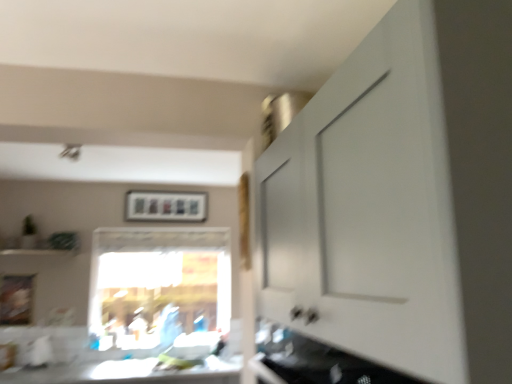
Question: Is point (287, 370) positioned closer to the camera than point (203, 200)?

Choices:
 (A) closer
 (B) farther

Answer: (A)

Question: Would you say white glossy cabinet at lower right, positioned as the 2th cabinetry in top-to-bottom order, is inside or outside matte plastic picture frame at upper center, the 2th picture frame positioned from the left?

Choices:
 (A) outside
 (B) inside

Answer: (A)

Question: Based on their relative distances, which object is farther from the matte plastic picture frame at upper center, which is the first picture frame from top to bottom?

Choices:
 (A) white glossy countertop at lower center
 (B) transparent glass window at center
 (C) white matte cabinet at upper right, which appears as the first cabinetry when viewed from the top
 (D) white glossy cabinet at lower right, which is the first cabinetry from bottom to top
 (E) wooden picture frame at lower left, arranged as the second picture frame when viewed from the back

Answer: (C)

Question: Considering the real-world distances, which object is closest to the wooden picture frame at lower left, arranged as the second picture frame when viewed from the back?

Choices:
 (A) transparent glass window at center
 (B) matte plastic picture frame at upper center, placed as the second picture frame when sorted from front to back
 (C) white glossy countertop at lower center
 (D) white glossy cabinet at lower right, which is the first cabinetry from bottom to top
 (E) white matte cabinet at upper right, which appears as the first cabinetry when viewed from the top

Answer: (C)